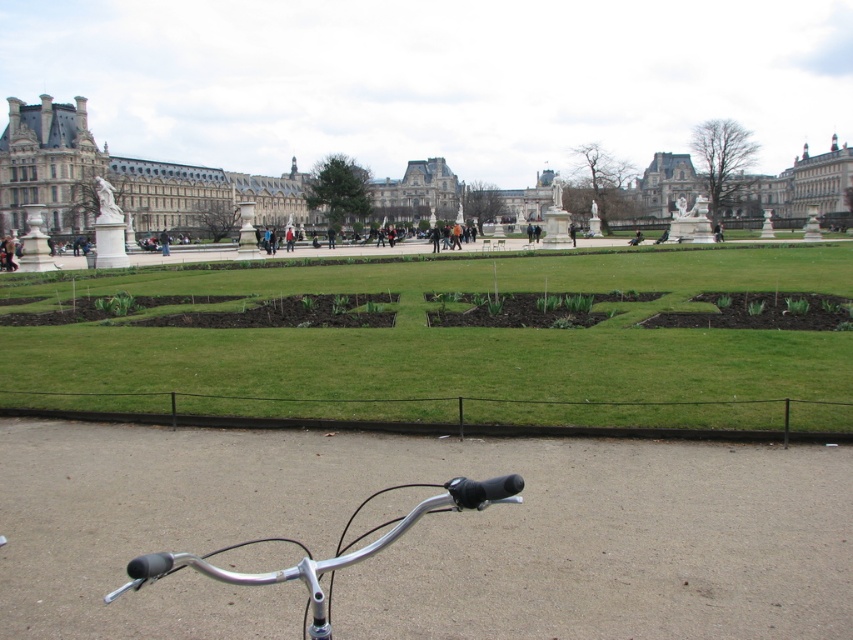
Question: Estimate the real-world distances between objects in this image. Which object is closer to the green grass at center?

Choices:
 (A) silver metallic bicycle handlebars at lower center
 (B) white stone palace at center

Answer: (A)

Question: Which of the following is the closest to the observer?

Choices:
 (A) [x=746, y=218]
 (B) [x=20, y=356]

Answer: (B)

Question: Is green grass at center thinner than white stone palace at center?

Choices:
 (A) yes
 (B) no

Answer: (A)

Question: Does green grass at center lie behind white stone palace at center?

Choices:
 (A) no
 (B) yes

Answer: (A)

Question: Does white stone palace at center appear over silver metallic bicycle handlebars at lower center?

Choices:
 (A) yes
 (B) no

Answer: (A)

Question: Which object is positioned farthest from the silver metallic bicycle handlebars at lower center?

Choices:
 (A) green grass at center
 (B) white stone palace at center

Answer: (B)